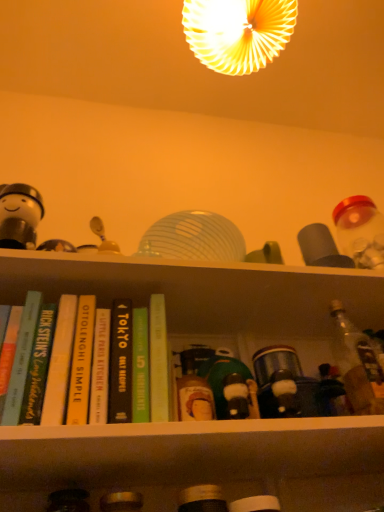
Question: In terms of height, does matte plastic bottles at center look taller or shorter compared to matte black bottle at lower center, the 2th bottle when ordered from bottom to top?

Choices:
 (A) short
 (B) tall

Answer: (A)

Question: Is matte plastic bottles at center wider or thinner than matte black bottle at lower center, the 2th bottle when ordered from bottom to top?

Choices:
 (A) wide
 (B) thin

Answer: (A)

Question: Which of these objects is positioned farthest from the clear glass bottle at right, which is the third bottle from bottom to top?

Choices:
 (A) matte yellow lampshade at upper center
 (B) hardcover book at left, which appears as the 5th book when viewed from the right
 (C) matte black bottle at lower center, arranged as the 2th bottle when viewed from the left
 (D) white matte figurine at left
 (E) matte black bottle at lower left, which is the 3th bottle from right to left

Answer: (A)

Question: Which object is the closest to the matte yellow lampshade at upper center?

Choices:
 (A) green matte book at center, the first book when ordered from right to left
 (B) hardcover book at center, which is the third book in left-to-right order
 (C) matte plastic bottles at center
 (D) clear glass bottle at right, the first bottle positioned from the top
 (E) hardcover book at left, the first book positioned from the left

Answer: (A)